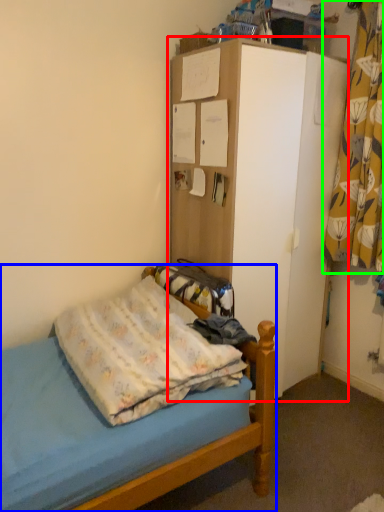
Question: Which object is positioned farthest from dresser (highlighted by a red box)? Select from bed (highlighted by a blue box) and curtain (highlighted by a green box).

Choices:
 (A) bed
 (B) curtain

Answer: (A)